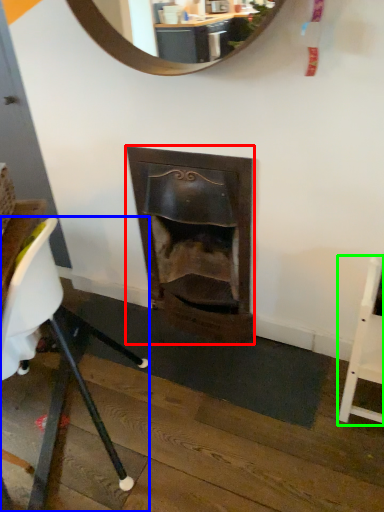
Question: Estimate the real-world distances between objects in this image. Which object is farther from fireplace (highlighted by a red box), chair (highlighted by a blue box) or chair (highlighted by a green box)?

Choices:
 (A) chair
 (B) chair

Answer: (B)